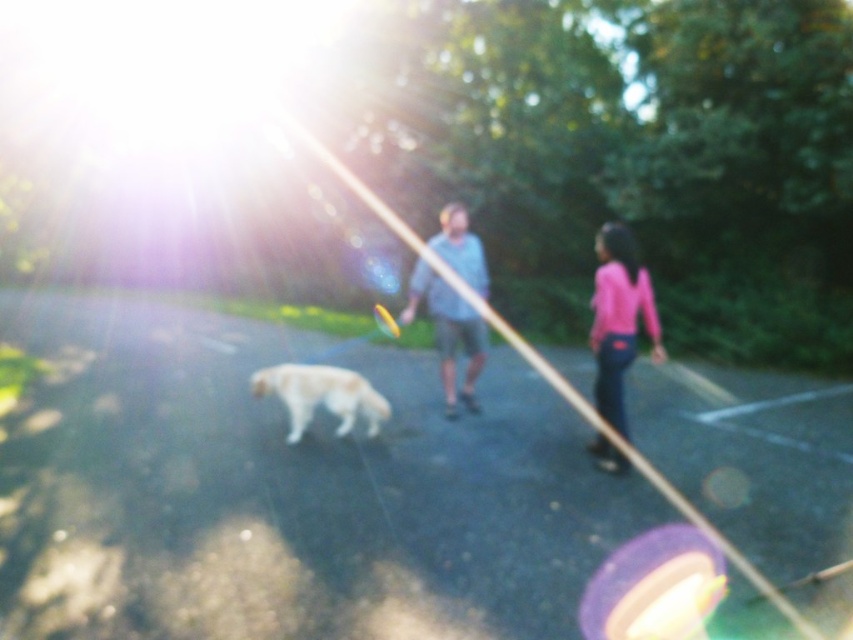
Which is behind, point (473, 337) or point (343, 429)?

The point (473, 337) is behind.

The image size is (853, 640). In order to click on light blue fabric shirt at center in this screenshot , I will do `click(448, 332)`.

Who is positioned more to the left, pink matte shirt at right or light blue fabric shirt at center?

From the viewer's perspective, light blue fabric shirt at center appears more on the left side.

Describe the element at coordinates (618, 317) in the screenshot. The image size is (853, 640). I see `pink matte shirt at right` at that location.

Image resolution: width=853 pixels, height=640 pixels. Find the location of `pink matte shirt at right`. pink matte shirt at right is located at coordinates (618, 317).

Is pink matte shirt at right thinner than golden fur dog at center?

Yes, pink matte shirt at right is thinner than golden fur dog at center.

Is pink matte shirt at right shorter than golden fur dog at center?

In fact, pink matte shirt at right may be taller than golden fur dog at center.

Between point (619, 412) and point (257, 380), which one is positioned in front?

Point (619, 412)

Identify the location of pink matte shirt at right. (618, 317).